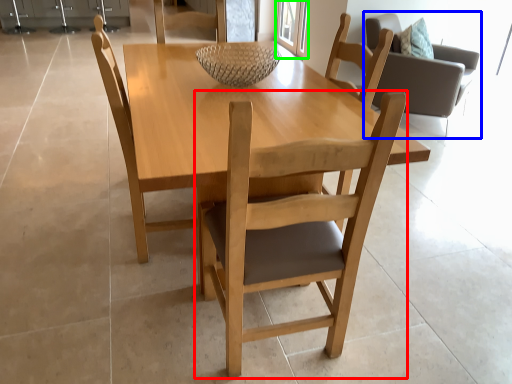
Question: Which object is positioned farthest from chair (highlighted by a red box)? Select from chair (highlighted by a blue box) and glass door (highlighted by a green box).

Choices:
 (A) chair
 (B) glass door

Answer: (B)